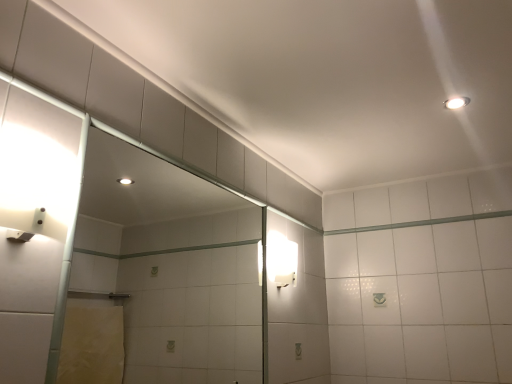
Question: Can you confirm if clear glass door at left is positioned to the right of white frosted glass sconce at right, which is the second light fixture from front to back?

Choices:
 (A) yes
 (B) no

Answer: (B)

Question: Can you confirm if clear glass door at left is smaller than white frosted glass sconce at right, the 1th light fixture when ordered from left to right?

Choices:
 (A) yes
 (B) no

Answer: (B)

Question: From a real-world perspective, is clear glass door at left on top of white frosted glass sconce at right, which is the first light fixture in bottom-to-top order?

Choices:
 (A) no
 (B) yes

Answer: (A)

Question: Is clear glass door at left surrounding white frosted glass sconce at right, the 2th light fixture positioned from the right?

Choices:
 (A) no
 (B) yes

Answer: (A)

Question: Considering the relative sizes of clear glass door at left and white frosted glass sconce at right, which is the second light fixture from front to back, in the image provided, is clear glass door at left shorter than white frosted glass sconce at right, which is the second light fixture from front to back,?

Choices:
 (A) yes
 (B) no

Answer: (B)

Question: From their relative heights in the image, would you say white glossy light fixture at upper right, placed as the first light fixture when sorted from right to left, is taller or shorter than white frosted glass sconce at right, the 2th light fixture positioned from the right?

Choices:
 (A) short
 (B) tall

Answer: (A)

Question: In the image, is white glossy light fixture at upper right, which appears as the second light fixture when viewed from the left, positioned in front of or behind white frosted glass sconce at right, the 2th light fixture positioned from the right?

Choices:
 (A) behind
 (B) front

Answer: (B)

Question: Considering the positions of white glossy light fixture at upper right, which is the first light fixture from front to back, and white frosted glass sconce at right, which is the second light fixture from front to back, in the image, is white glossy light fixture at upper right, which is the first light fixture from front to back, wider or thinner than white frosted glass sconce at right, which is the second light fixture from front to back,?

Choices:
 (A) thin
 (B) wide

Answer: (B)

Question: From the image's perspective, is white glossy light fixture at upper right, which appears as the second light fixture when viewed from the left, above or below white frosted glass sconce at right, which is the first light fixture in bottom-to-top order?

Choices:
 (A) above
 (B) below

Answer: (A)

Question: From a real-world perspective, is white frosted glass sconce at right, which is the first light fixture in bottom-to-top order, positioned above or below clear glass door at left?

Choices:
 (A) below
 (B) above

Answer: (B)

Question: Is point (275, 259) closer or farther from the camera than point (75, 271)?

Choices:
 (A) closer
 (B) farther

Answer: (A)

Question: Relative to clear glass door at left, is white frosted glass sconce at right, which is the first light fixture in bottom-to-top order, in front or behind?

Choices:
 (A) front
 (B) behind

Answer: (B)

Question: Considering the positions of white frosted glass sconce at right, the 2th light fixture positioned from the top, and clear glass door at left in the image, is white frosted glass sconce at right, the 2th light fixture positioned from the top, wider or thinner than clear glass door at left?

Choices:
 (A) thin
 (B) wide

Answer: (B)

Question: Considering the relative positions of white frosted glass sconce at right, which is the second light fixture from front to back, and white glossy light fixture at upper right, which appears as the second light fixture when viewed from the back, in the image provided, is white frosted glass sconce at right, which is the second light fixture from front to back, to the left or to the right of white glossy light fixture at upper right, which appears as the second light fixture when viewed from the back,?

Choices:
 (A) left
 (B) right

Answer: (A)

Question: From the image's perspective, relative to white glossy light fixture at upper right, which appears as the second light fixture when viewed from the left, is white frosted glass sconce at right, the 2th light fixture positioned from the right, above or below?

Choices:
 (A) below
 (B) above

Answer: (A)